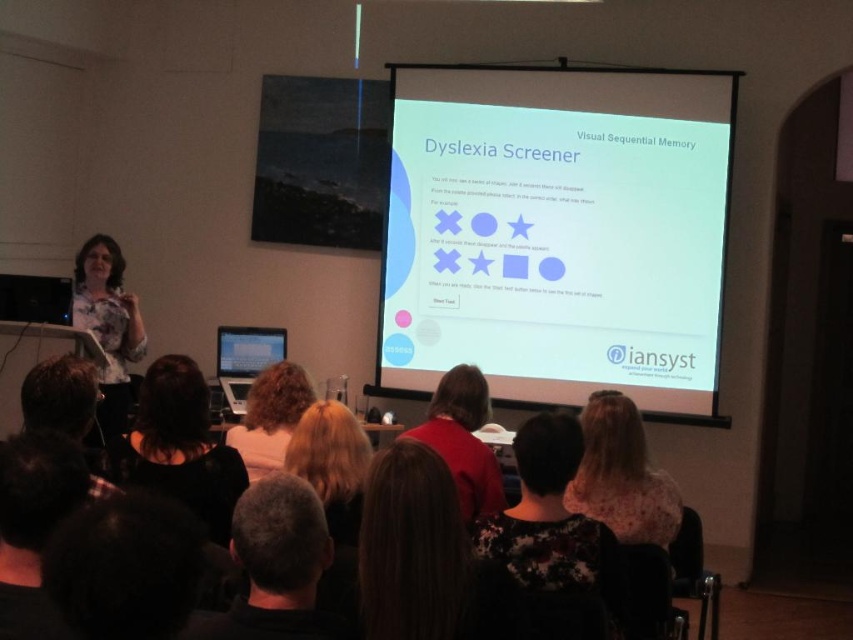
Between point (100, 410) and point (442, 416), which one is positioned behind?

The point (100, 410) is behind.

Is white printed shirt at left behind red sweater at center?

Yes, it is behind red sweater at center.

Does point (119, 257) come behind point (474, 381)?

Yes, it is behind point (474, 381).

At what (x,y) coordinates should I click in order to perform the action: click on white printed shirt at left. Please return your answer as a coordinate pair (x, y). The image size is (853, 640). Looking at the image, I should click on (108, 324).

Who is positioned more to the right, white glossy projector screen at center or dark hair at upper center?

From the viewer's perspective, white glossy projector screen at center appears more on the right side.

Who is more forward, [724,161] or [9,481]?

Positioned in front is point [9,481].

Image resolution: width=853 pixels, height=640 pixels. I want to click on white glossy projector screen at center, so click(x=556, y=232).

Which of these two, dark brown hair at lower center or dark hair at upper center, stands taller?

dark hair at upper center is taller.

I want to click on dark brown hair at lower center, so click(276, 564).